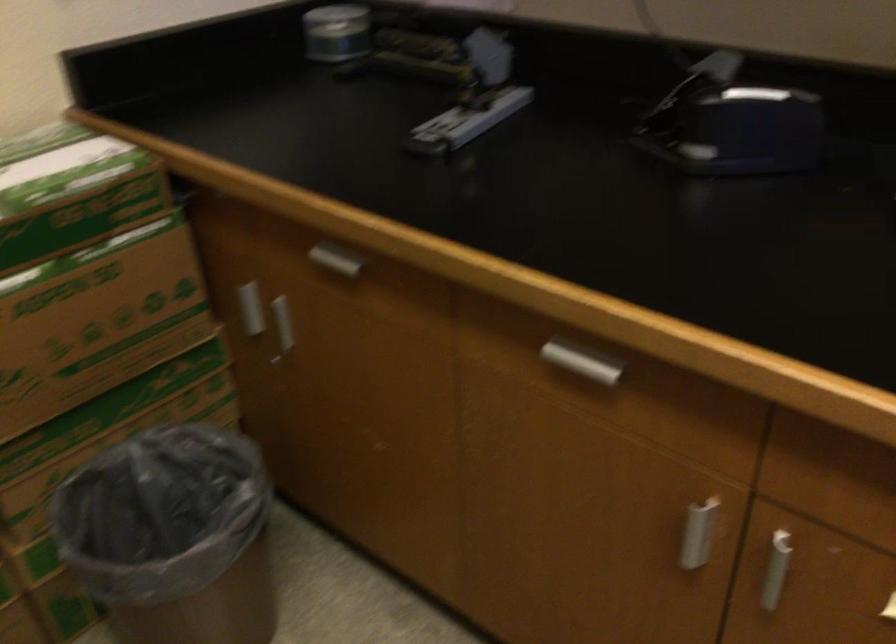
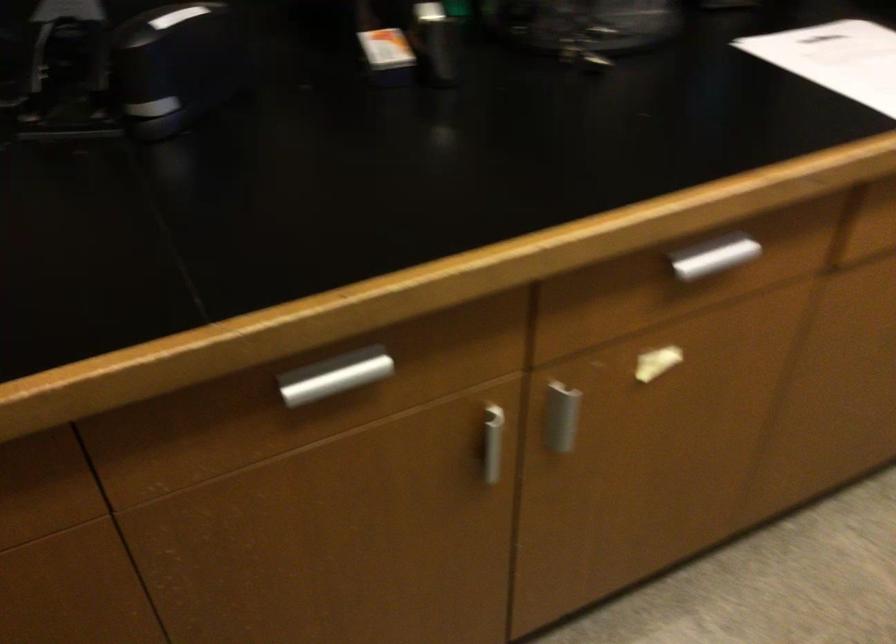
The first image is from the beginning of the video and the second image is from the end. How did the camera likely rotate when shooting the video?

The camera's rotation is toward right-down.